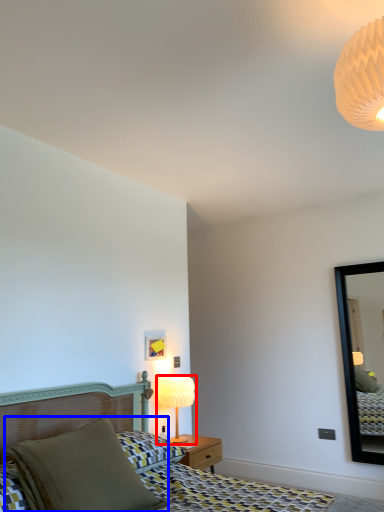
Question: Which point is closer to the camera, table lamp (highlighted by a red box) or pillow (highlighted by a blue box)?

Choices:
 (A) table lamp
 (B) pillow

Answer: (B)